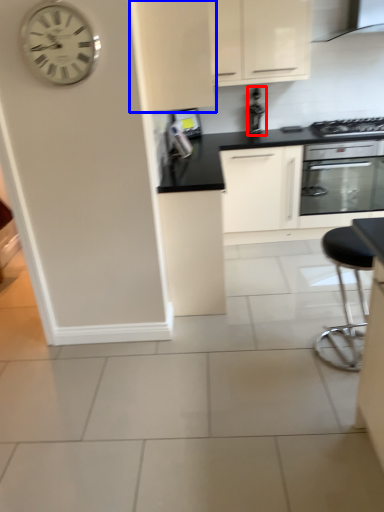
Question: Among these objects, which one is nearest to the camera, appliance (highlighted by a red box) or cabinetry (highlighted by a blue box)?

Choices:
 (A) appliance
 (B) cabinetry

Answer: (B)